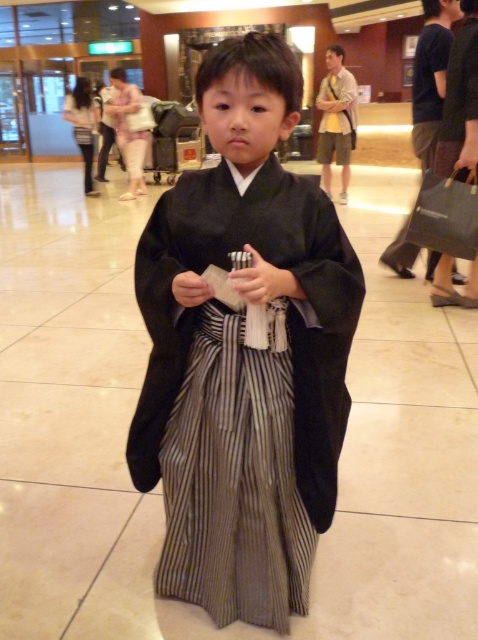
Who is positioned more to the right, black silk kimono at center or striped cotton kimono at center?

black silk kimono at center is more to the right.

You are a GUI agent. You are given a task and a screenshot of the screen. Output one action in this format:
    pyautogui.click(x=<x>, y=<y>)
    Task: Click on the black silk kimono at center
    The height and width of the screenshot is (640, 478).
    Given the screenshot: What is the action you would take?
    pyautogui.click(x=243, y=352)